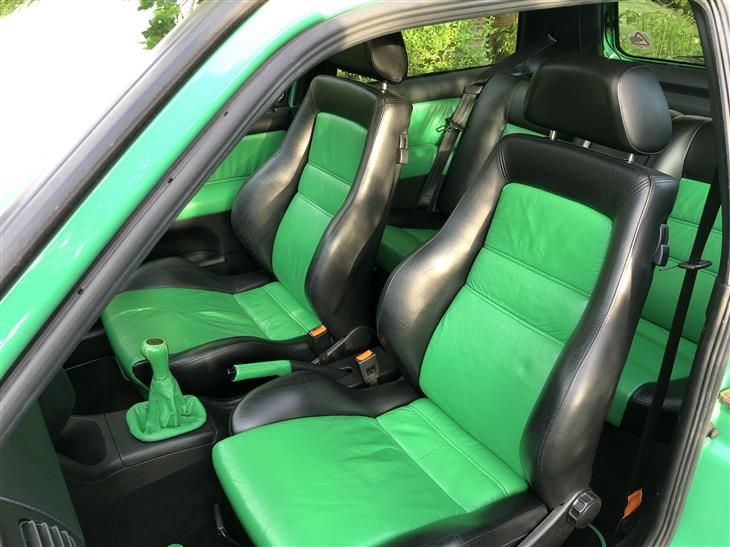
The image size is (730, 547). Identify the location of vent. (33, 544).